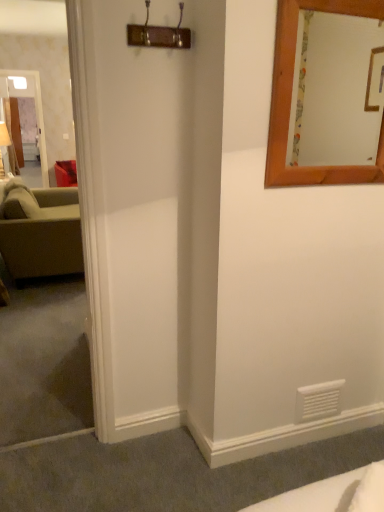
Identify the location of green fabric couch at left. (40, 232).

You are a GUI agent. You are given a task and a screenshot of the screen. Output one action in this format:
    pyautogui.click(x=<x>, y=<y>)
    Task: Click on the clear glass door at left
    
    Given the screenshot: What is the action you would take?
    pyautogui.click(x=35, y=105)

Locate an element on the screen. The width and height of the screenshot is (384, 512). wooden-framed mirror at upper right is located at coordinates (333, 91).

From the image's perspective, which one is positioned lower, clear glass door at left or wooden-framed mirror at upper right?

wooden-framed mirror at upper right, from the image's perspective.

Which is behind, point (41, 102) or point (329, 59)?

Point (41, 102)

Who is smaller, clear glass door at left or wooden-framed mirror at upper right?

wooden-framed mirror at upper right.

Is wooden-framed mirror at upper right at the back of clear glass door at left?

No.

How distant is green fabric couch at left from wooden-framed mirror at upper right?

2.53 meters.

From the image's perspective, is green fabric couch at left located above or below wooden-framed mirror at upper right?

Based on their image positions, green fabric couch at left is located beneath wooden-framed mirror at upper right.

Is green fabric couch at left thinner than wooden-framed mirror at upper right?

In fact, green fabric couch at left might be wider than wooden-framed mirror at upper right.

Is there a large distance between green fabric couch at left and wooden-framed mirror at upper right?

green fabric couch at left is positioned a significant distance from wooden-framed mirror at upper right.

The image size is (384, 512). I want to click on studio couch below the wooden-framed mirror at upper right (from a real-world perspective), so click(x=40, y=232).

Which is behind, wooden-framed mirror at upper right or green fabric couch at left?

green fabric couch at left is further away from the camera.

From the image's perspective, which is below, wooden-framed mirror at upper right or green fabric couch at left?

green fabric couch at left.

How distant is wooden-framed mirror at upper right from green fabric couch at left?

wooden-framed mirror at upper right and green fabric couch at left are 8.31 feet apart.

Is wooden-framed mirror at upper right not within clear glass door at left?

Indeed, wooden-framed mirror at upper right is completely outside clear glass door at left.

From a real-world perspective, is wooden-framed mirror at upper right located beneath clear glass door at left?

No, from a real-world perspective, wooden-framed mirror at upper right is not below clear glass door at left.

Can you confirm if wooden-framed mirror at upper right is taller than clear glass door at left?

No, wooden-framed mirror at upper right is not taller than clear glass door at left.

Considering the sizes of objects wooden-framed mirror at upper right and clear glass door at left in the image provided, who is wider, wooden-framed mirror at upper right or clear glass door at left?

Wider between the two is clear glass door at left.

Is point (7, 76) farther from camera compared to point (15, 217)?

That is True.

Is clear glass door at left in front of or behind green fabric couch at left in the image?

clear glass door at left is positioned farther from the viewer than green fabric couch at left.

From a real-world perspective, is clear glass door at left located higher than green fabric couch at left?

Yes, from a real-world perspective, clear glass door at left is on top of green fabric couch at left.

Based on the photo, visually, is green fabric couch at left positioned to the left or to the right of clear glass door at left?

green fabric couch at left is to the right of clear glass door at left.

From the picture: Does green fabric couch at left have a smaller size compared to clear glass door at left?

No, green fabric couch at left is not smaller than clear glass door at left.

From the image's perspective, is green fabric couch at left on top of clear glass door at left?

Actually, green fabric couch at left appears below clear glass door at left in the image.

Considering the relative sizes of green fabric couch at left and clear glass door at left in the image provided, is green fabric couch at left taller than clear glass door at left?

No.

Where is `glass door lying above the wooden-framed mirror at upper right (from the image's perspective)`? glass door lying above the wooden-framed mirror at upper right (from the image's perspective) is located at coordinates (35, 105).

I want to click on studio couch below the wooden-framed mirror at upper right (from a real-world perspective), so click(40, 232).

Considering their positions, is wooden-framed mirror at upper right positioned further to green fabric couch at left than clear glass door at left?

Based on the image, clear glass door at left appears to be further to green fabric couch at left.

Considering their positions, is wooden-framed mirror at upper right positioned further to clear glass door at left than green fabric couch at left?

wooden-framed mirror at upper right lies further to clear glass door at left than the other object.

Looking at this image, when comparing their distances from wooden-framed mirror at upper right, does clear glass door at left or green fabric couch at left seem closer?

green fabric couch at left lies closer to wooden-framed mirror at upper right than the other object.

From the image, which object appears to be nearer to wooden-framed mirror at upper right, green fabric couch at left or clear glass door at left?

Based on the image, green fabric couch at left appears to be nearer to wooden-framed mirror at upper right.

Which object lies nearer to the anchor point green fabric couch at left, clear glass door at left or wooden-framed mirror at upper right?

wooden-framed mirror at upper right lies closer to green fabric couch at left than the other object.

Based on their spatial positions, is green fabric couch at left or wooden-framed mirror at upper right further from clear glass door at left?

Among the two, wooden-framed mirror at upper right is located further to clear glass door at left.

I want to click on studio couch between wooden-framed mirror at upper right and clear glass door at left along the z-axis, so click(x=40, y=232).